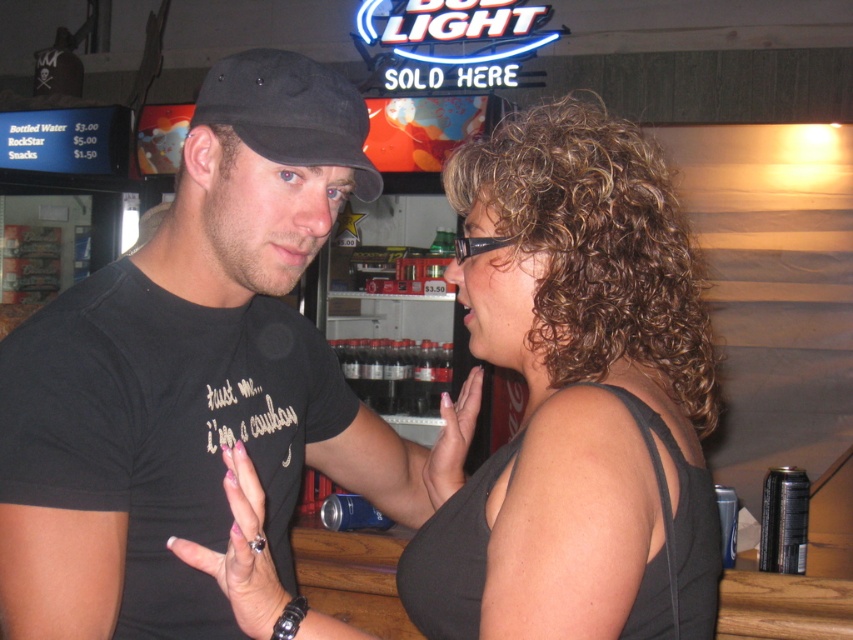
Question: Is black fabric baseball cap at upper left further to camera compared to pink nail polish at center?

Choices:
 (A) yes
 (B) no

Answer: (B)

Question: Where is black matte t-shirt at center located in relation to dark glass bottles at center in the image?

Choices:
 (A) right
 (B) left

Answer: (A)

Question: Among these objects, which one is farthest from the camera?

Choices:
 (A) pink nail polish at center
 (B) black matte t-shirt at center
 (C) shiny black ring at center
 (D) black fabric baseball cap at upper left

Answer: (A)

Question: Can you confirm if black matte t-shirt at center is wider than dark glass bottles at center?

Choices:
 (A) no
 (B) yes

Answer: (A)

Question: Which of the following is the closest to the observer?

Choices:
 (A) (438, 388)
 (B) (225, 400)
 (C) (299, 74)

Answer: (C)

Question: Among these objects, which one is farthest from the camera?

Choices:
 (A) black fabric baseball cap at upper left
 (B) matte black tank top at center
 (C) black matte t-shirt at center
 (D) shiny black ring at center

Answer: (A)